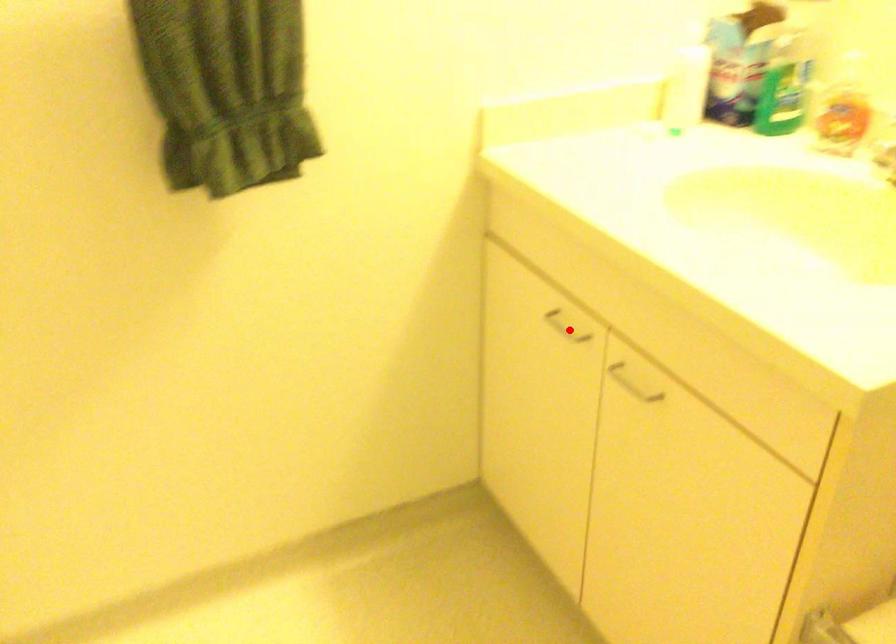
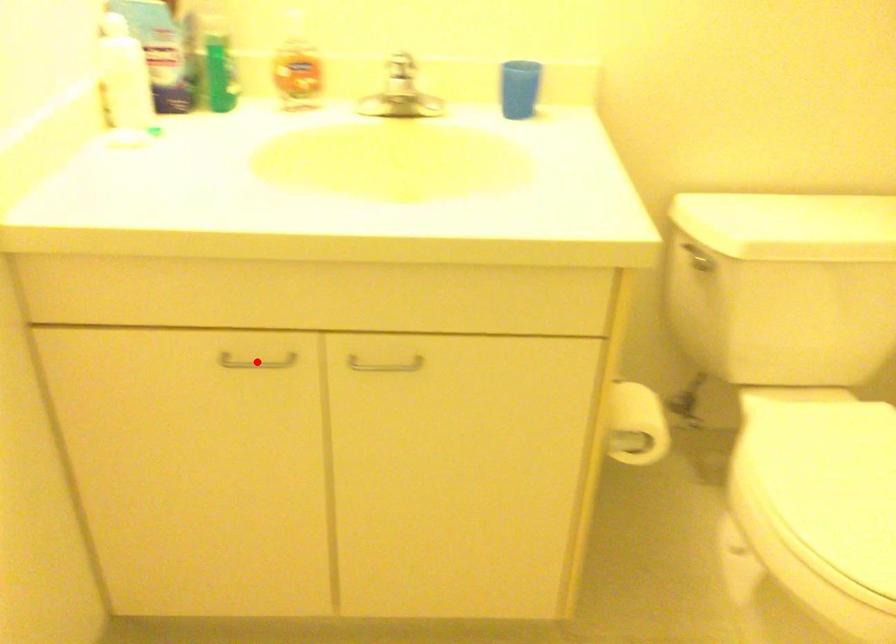
I am providing you with two images of the same scene from different viewpoints. A red point is marked on the first image and another point is marked on the second image. Do the highlighted points in image1 and image2 indicate the same real-world spot?

Yes